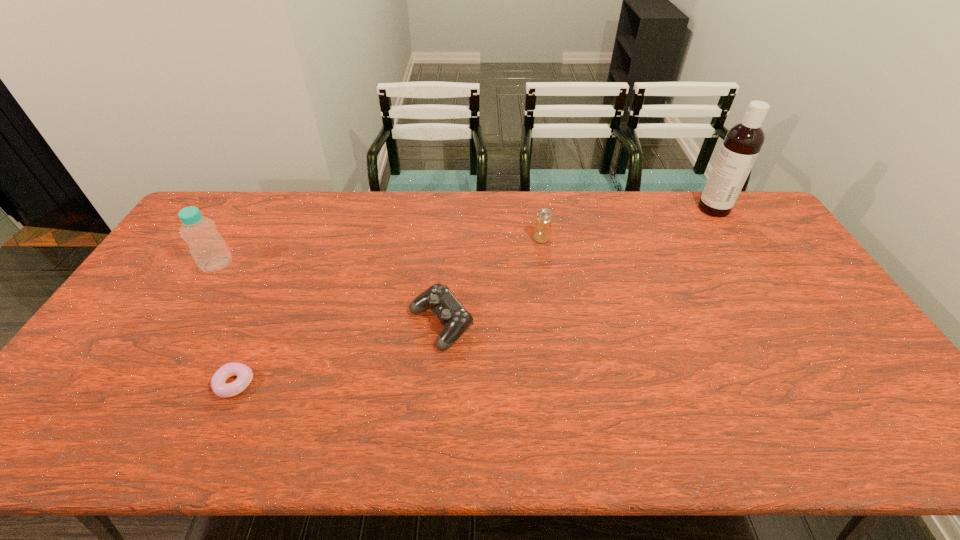
The height and width of the screenshot is (540, 960). I want to click on free space located on the label side of the rightmost object, so click(626, 209).

Locate an element on the screen. vacant space located on the label side of the rightmost object is located at coordinates (665, 209).

You are a GUI agent. You are given a task and a screenshot of the screen. Output one action in this format:
    pyautogui.click(x=<x>, y=<y>)
    Task: Click on the vacant region located on the label side of the rightmost object
    
    Given the screenshot: What is the action you would take?
    pyautogui.click(x=588, y=209)

The height and width of the screenshot is (540, 960). In order to click on free space located on the right of the bottle in this screenshot , I will do `click(303, 264)`.

You are a GUI agent. You are given a task and a screenshot of the screen. Output one action in this format:
    pyautogui.click(x=<x>, y=<y>)
    Task: Click on the blank area located 0.180m on the front of the saltshaker
    
    Given the screenshot: What is the action you would take?
    pyautogui.click(x=548, y=284)

Locate an element on the screen. The height and width of the screenshot is (540, 960). free point located on the front of the second nearest object is located at coordinates (434, 415).

Where is `blank space located on the left of the shortest object`? This screenshot has height=540, width=960. blank space located on the left of the shortest object is located at coordinates (146, 384).

The image size is (960, 540). I want to click on object present at the far edge, so click(x=743, y=142).

Identify the location of object at the left edge. (207, 247).

Image resolution: width=960 pixels, height=540 pixels. Identify the location of object located at the right edge. (743, 142).